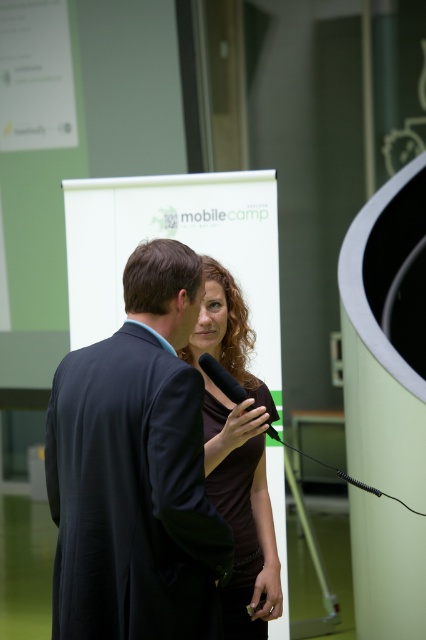
Question: Is dark blue suit at center below brown matte dress at center?

Choices:
 (A) yes
 (B) no

Answer: (B)

Question: Among these objects, which one is farthest from the camera?

Choices:
 (A) brown matte dress at center
 (B) black matte microphone at center
 (C) dark blue suit at center

Answer: (A)

Question: Which object is closer to the camera taking this photo?

Choices:
 (A) brown matte dress at center
 (B) dark blue suit at center

Answer: (B)

Question: Which is farther from the black matte microphone at center?

Choices:
 (A) dark blue suit at center
 (B) brown matte dress at center

Answer: (A)

Question: Can you confirm if dark blue suit at center is smaller than black matte microphone at center?

Choices:
 (A) no
 (B) yes

Answer: (A)

Question: Is dark blue suit at center wider than brown matte dress at center?

Choices:
 (A) no
 (B) yes

Answer: (B)